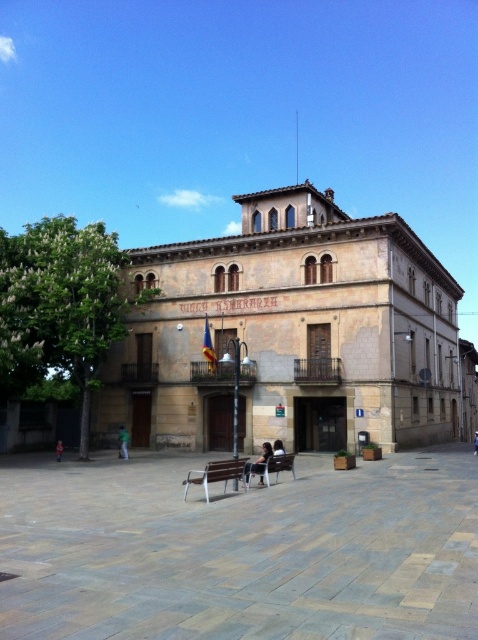
You are standing at the entrance of the two story building and see a point marked at coordinates (217, 474). What object is located at that point?

The point at coordinates (217, 474) corresponds to the metallic silver bench at center.

You are a visitor standing in front of the two story building. You see a metallic silver bench at center and dark blue jeans at lower left. Which object is taller?

The metallic silver bench at center is much taller than the dark blue jeans at lower left.